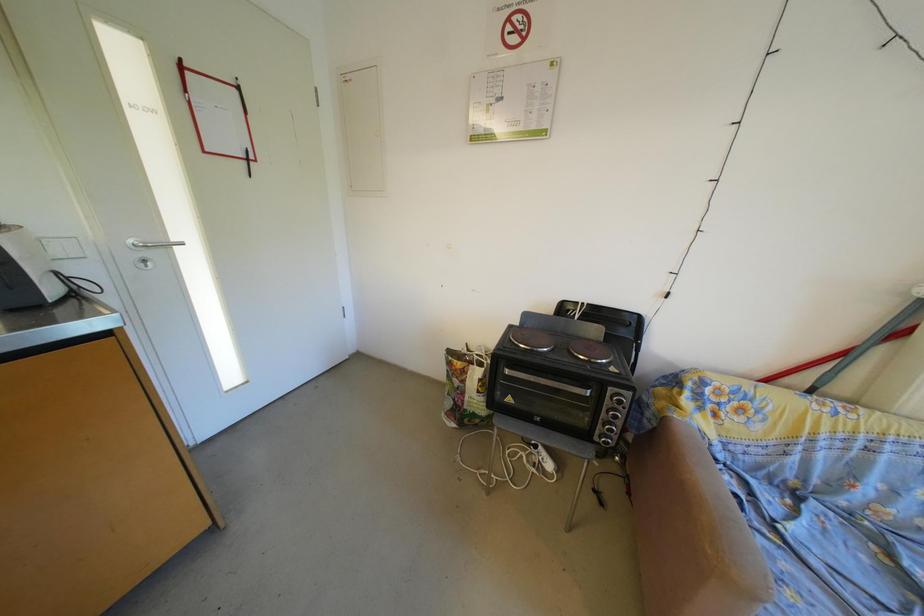
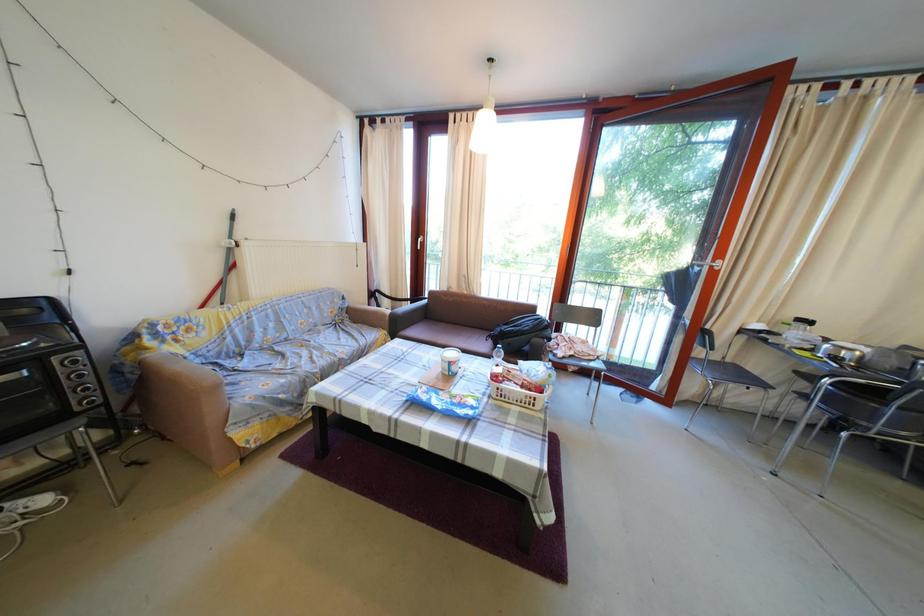
The first image is from the beginning of the video and the second image is from the end. How did the camera likely rotate when shooting the video?

The rotation direction of the camera is right-down.